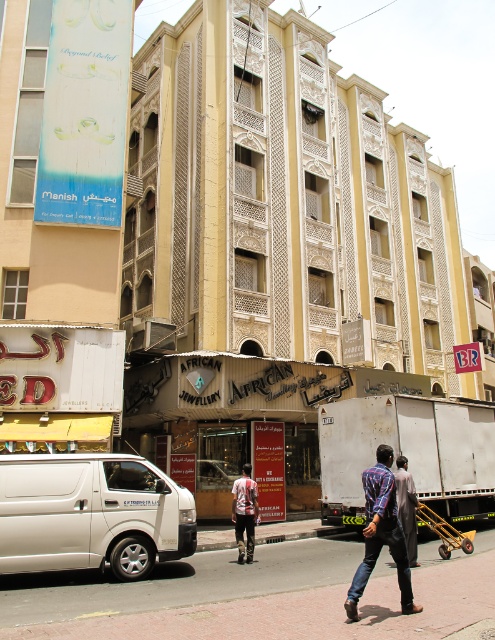
From the picture: You are a delivery person who needs to park your white matte van at lower left on the paved concrete sidewalk at lower center. Is there enough space for the van to park there?

The paved concrete sidewalk at lower center is below the white matte van at lower left, which means the van is already parked there. Therefore, there is space for the van to park on the sidewalk.

In the scene shown: You are a delivery driver who needs to park your white matte van at lower left near the building with the African Jewellery shop. Based on the coordinates provided, can you estimate whether the van is already positioned close to the building?

The white matte van at lower left is located at point (92, 513), which is near the building with the African Jewellery shop, so yes, it is positioned close to the building.